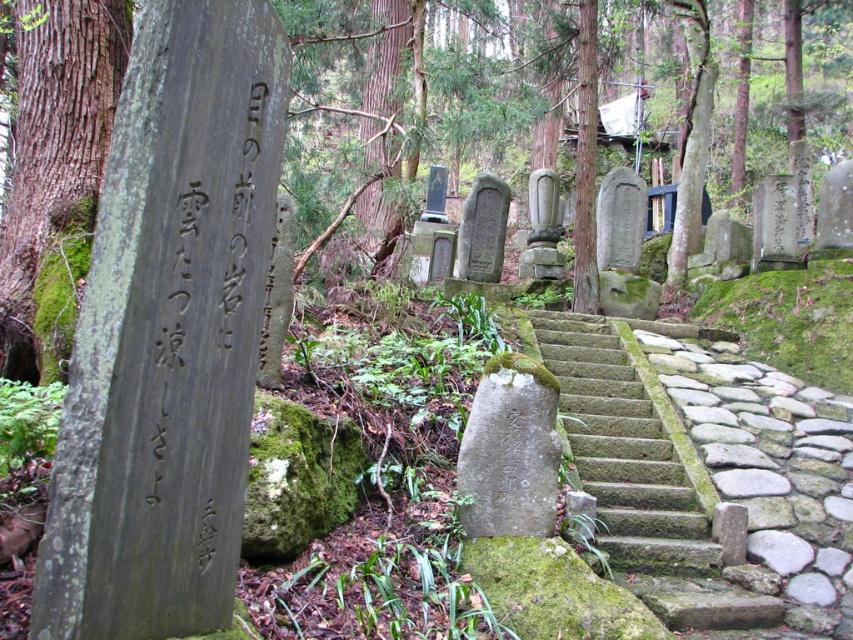
Question: Can you confirm if smooth gray stone at center is wider than green mossy stone at left?

Choices:
 (A) no
 (B) yes

Answer: (A)

Question: Does smooth gray stone at center appear on the right side of green mossy stone stairs at center?

Choices:
 (A) yes
 (B) no

Answer: (B)

Question: Which object is the closest to the green mossy stone at left?

Choices:
 (A) green mossy stone stairs at center
 (B) gray stone gravestone at center
 (C) smooth gray stone at center

Answer: (A)

Question: Is green mossy stone stairs at center smaller than gray stone gravestone at center?

Choices:
 (A) yes
 (B) no

Answer: (B)

Question: Which of these objects is positioned closest to the smooth gray stone at center?

Choices:
 (A) green mossy stone stairs at center
 (B) gray stone gravestone at center
 (C) green mossy stone at left

Answer: (B)

Question: Which of the following is the closest to the observer?

Choices:
 (A) (508, 436)
 (B) (341, 35)
 (C) (144, 106)

Answer: (C)